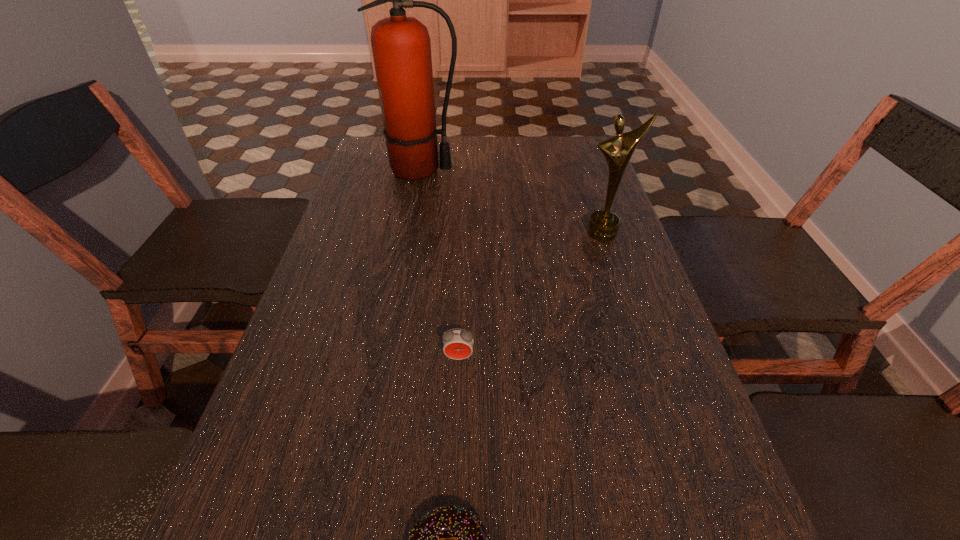
What are the coordinates of `object that is at the left edge` in the screenshot? It's located at (401, 46).

You are a GUI agent. You are given a task and a screenshot of the screen. Output one action in this format:
    pyautogui.click(x=<x>, y=<y>)
    Task: Click on the object located in the right edge section of the desktop
    
    Given the screenshot: What is the action you would take?
    pyautogui.click(x=603, y=225)

Where is `object that is at the far left corner`? The width and height of the screenshot is (960, 540). object that is at the far left corner is located at coordinates (401, 46).

Where is `free space at the far edge`? free space at the far edge is located at coordinates tap(491, 170).

Find the location of a particular element. Image resolution: width=960 pixels, height=540 pixels. vacant space at the left edge is located at coordinates (286, 495).

Identify the location of free space at the right edge. Image resolution: width=960 pixels, height=540 pixels. (666, 322).

I want to click on vacant region at the far right corner, so click(x=592, y=167).

Locate an element on the screen. unoccupied area between the award and the fire extinguisher is located at coordinates (512, 201).

This screenshot has height=540, width=960. Identify the location of vacant area that lies between the alarm clock and the award. (531, 295).

The width and height of the screenshot is (960, 540). I want to click on free space between the alarm clock and the farthest object, so click(x=440, y=264).